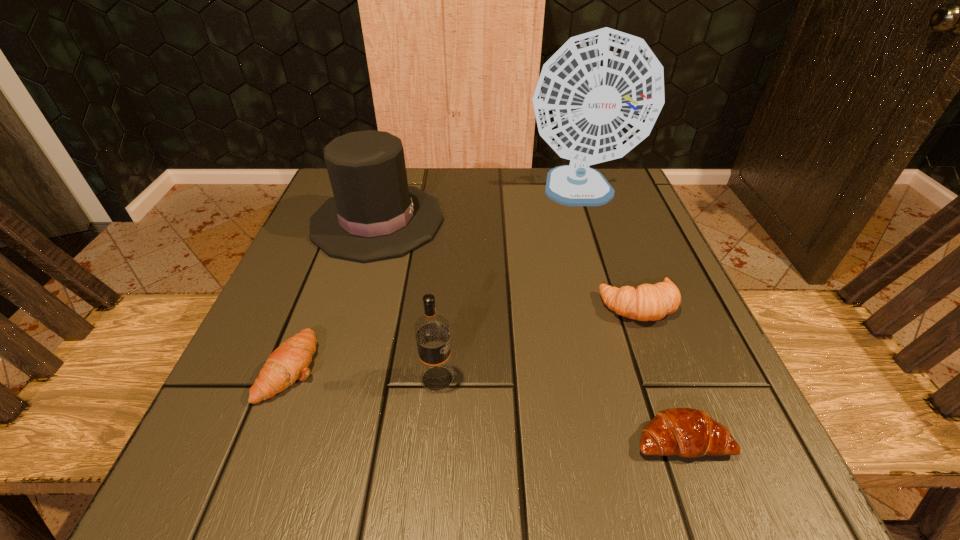
You are a GUI agent. You are given a task and a screenshot of the screen. Output one action in this format:
    pyautogui.click(x=<x>, y=<y>)
    Task: Click on the crescent roll that stands as the third closest to the fan
    
    Given the screenshot: What is the action you would take?
    point(289,362)

The width and height of the screenshot is (960, 540). I want to click on vacant region that satisfies the following two spatial constraints: 1. on the back side of the nearest crescent roll; 2. on the label of the vodka, so click(660, 379).

Locate an element on the screen. This screenshot has width=960, height=540. free space that satisfies the following two spatial constraints: 1. on the grille of the fan; 2. on the label of the vodka is located at coordinates (638, 379).

Locate an element on the screen. The image size is (960, 540). free spot that satisfies the following two spatial constraints: 1. on the grille of the fan; 2. on the front of the dress hat with the decoration is located at coordinates (588, 221).

The height and width of the screenshot is (540, 960). In order to click on vacant space that satisfies the following two spatial constraints: 1. on the front of the dress hat with the decoration; 2. on the left side of the nearest crescent roll in this screenshot , I will do `click(312, 439)`.

Locate an element on the screen. Image resolution: width=960 pixels, height=540 pixels. vacant point that satisfies the following two spatial constraints: 1. on the grille of the nearest crescent roll; 2. on the left side of the fan is located at coordinates (658, 439).

I want to click on free spot that satisfies the following two spatial constraints: 1. on the front of the third farthest object with the decoration; 2. on the right side of the dress hat, so click(x=352, y=305).

Identify the location of blank space that satisfies the following two spatial constraints: 1. on the back side of the nearest object; 2. on the front of the dress hat with the decoration. This screenshot has height=540, width=960. (603, 221).